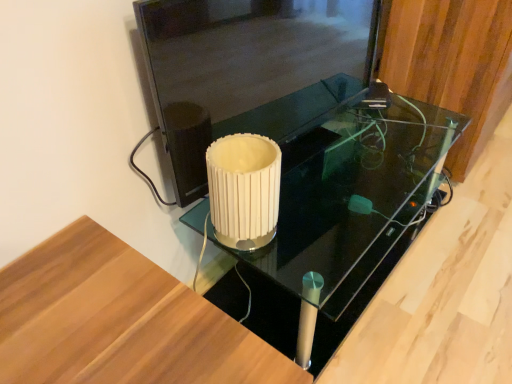
Question: In terms of height, does black glass table at center look taller or shorter compared to wooden panel at upper right?

Choices:
 (A) short
 (B) tall

Answer: (A)

Question: In terms of size, does black glass table at center appear bigger or smaller than wooden panel at upper right?

Choices:
 (A) small
 (B) big

Answer: (A)

Question: Estimate the real-world distances between objects in this image. Which object is farther from the transparent glass door at center?

Choices:
 (A) black glass table at center
 (B) wooden panel at upper right
 (C) white ribbed glass at center

Answer: (B)

Question: Estimate the real-world distances between objects in this image. Which object is farther from the wooden panel at upper right?

Choices:
 (A) white ribbed glass at center
 (B) black glass table at center
 (C) transparent glass door at center

Answer: (A)